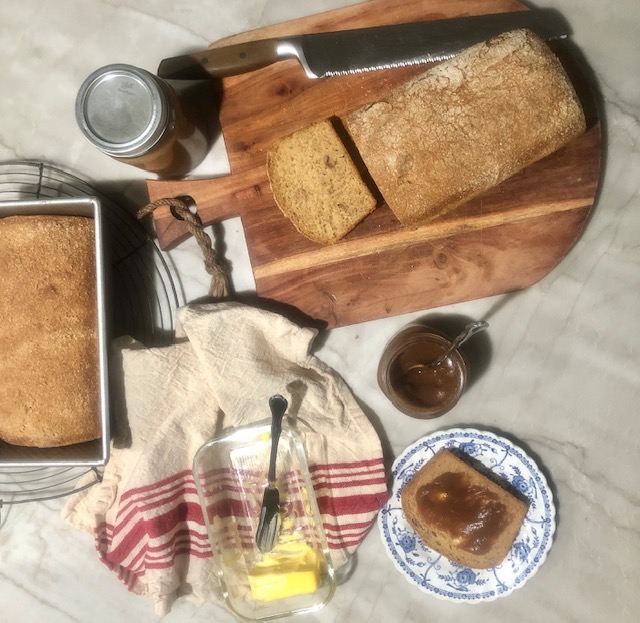
Find the location of a particular element. Image resolution: width=640 pixels, height=623 pixels. spoon is located at coordinates [x=460, y=340].